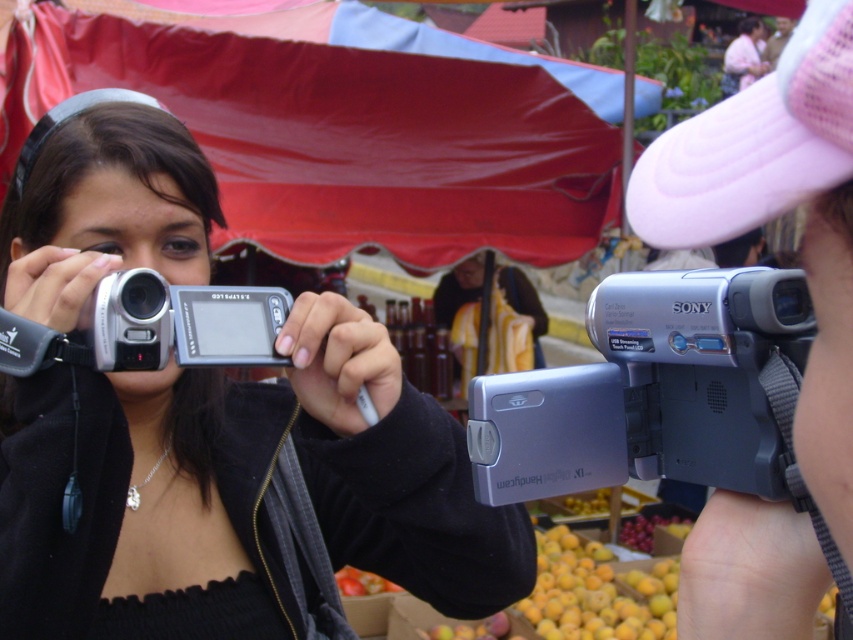
You are a photographer at the market and need to choose between the silver metallic camcorder at center and the silver metallic digital camera at center for capturing a quick video. Which device is more suitable for recording short clips?

The silver metallic digital camera at center is more suitable for recording short clips because it is smaller in size compared to the silver metallic camcorder at center, making it easier to handle quickly.

Based on the photo, you are a photographer trying to capture a wide shot of the market scene. You have two cameras available, the silver metallic camera at center and the silver metallic digital camera at center. Since you want to ensure both cameras can fit in your shot without overlapping, what is the minimum distance you should keep between them?

The silver metallic camera at center and the silver metallic digital camera at center are 7.33 inches apart from each other. To ensure they don not overlap in your shot, you should keep them at least 7.33 inches apart.

You are standing in the market and want to take a photo of both the point at coordinates point (123, 548) and point (207, 300). Since you can only focus on one point at a time, which point should you focus on to ensure the other is also in focus?

You should focus on point (207, 300) because it is closer to the camera than point (123, 548). By focusing on the closer point, the further point will still be within the depth of field and in focus.